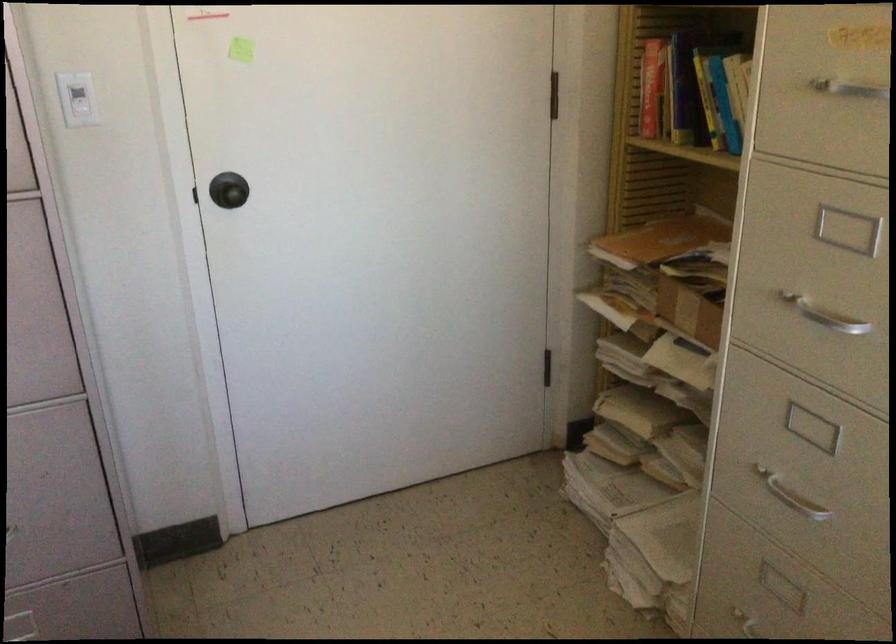
This screenshot has width=896, height=644. What do you see at coordinates (228, 190) in the screenshot?
I see `the black door knob` at bounding box center [228, 190].